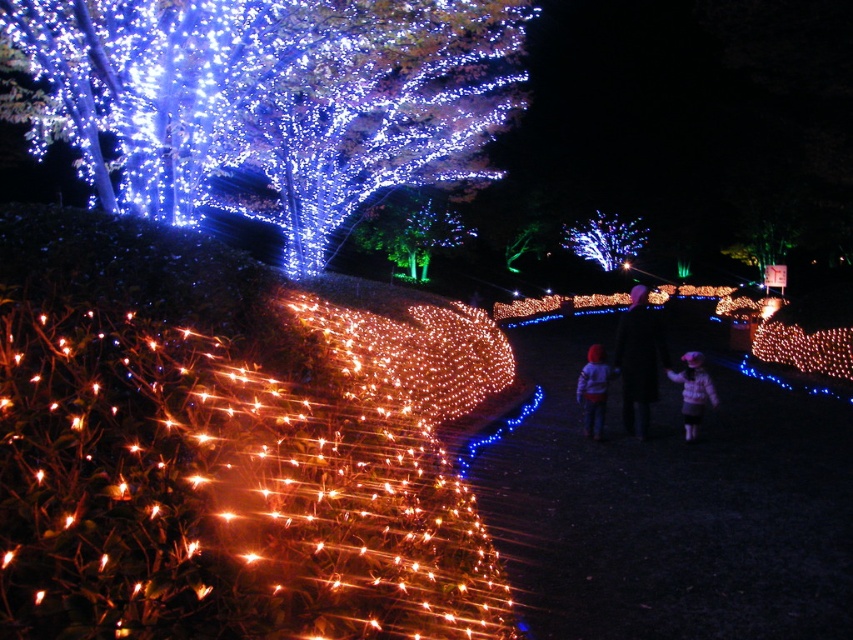
Question: Is illuminated plastic tree at upper left thinner than fluffy pink coat at center?

Choices:
 (A) yes
 (B) no

Answer: (B)

Question: Is black fabric at center below matte pink coat at lower right?

Choices:
 (A) no
 (B) yes

Answer: (A)

Question: Which point appears farthest from the camera in this image?

Choices:
 (A) (602, 220)
 (B) (22, 10)
 (C) (714, 387)

Answer: (A)

Question: Estimate the real-world distances between objects in this image. Which object is closer to the matte pink coat at lower right?

Choices:
 (A) illuminated wireframe tree at upper center
 (B) black fabric at center
 (C) fluffy pink coat at center

Answer: (B)

Question: Does illuminated plastic tree at upper left lie in front of matte pink coat at lower right?

Choices:
 (A) no
 (B) yes

Answer: (B)

Question: Which of the following is the closest to the observer?

Choices:
 (A) (170, 186)
 (B) (599, 406)
 (C) (86, 342)
 (D) (651, 337)

Answer: (C)